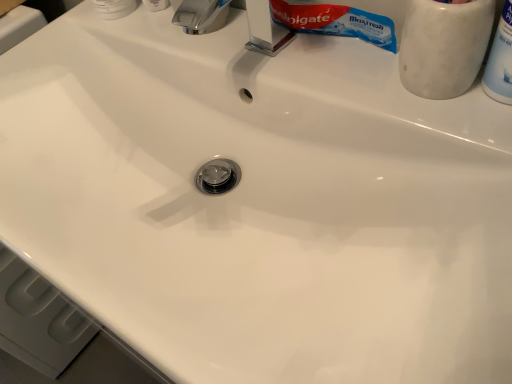
What is the approximate width of chrome metallic faucet at upper center?

It is 8.03 centimeters.

What do you see at coordinates (265, 30) in the screenshot? I see `chrome metallic faucet at upper center` at bounding box center [265, 30].

Locate an element on the screen. white marble toothbrush holder at upper right, which ranks as the second toiletry in right-to-left order is located at coordinates (444, 46).

Considering the points (117, 14) and (504, 31), which point is in front, point (117, 14) or point (504, 31)?

The point (504, 31) is more forward.

Is white plastic bottle at upper right, marked as the third toiletry in a left-to-right arrangement, located within white plastic toothpaste tube at upper left, which ranks as the first toiletry in left-to-right order?

No, white plastic bottle at upper right, marked as the third toiletry in a left-to-right arrangement, is located outside of white plastic toothpaste tube at upper left, which ranks as the first toiletry in left-to-right order.

From the image's perspective, between white plastic toothpaste tube at upper left, arranged as the 3th toiletry when viewed from the right, and white plastic bottle at upper right, which is counted as the first toiletry, starting from the right, who is located below?

white plastic bottle at upper right, which is counted as the first toiletry, starting from the right, is shown below in the image.

Is white plastic bottle at upper right, marked as the third toiletry in a left-to-right arrangement, positioned with its back to chrome metallic faucet at upper center?

No, white plastic bottle at upper right, marked as the third toiletry in a left-to-right arrangement,'s orientation is not away from chrome metallic faucet at upper center.

At what (x,y) coordinates should I click in order to perform the action: click on faucet on the left of white plastic bottle at upper right, marked as the third toiletry in a left-to-right arrangement. Please return your answer as a coordinate pair (x, y). This screenshot has width=512, height=384. Looking at the image, I should click on pyautogui.click(x=265, y=30).

From a real-world perspective, is white plastic bottle at upper right, which is counted as the first toiletry, starting from the right, above or below chrome metallic faucet at upper center?

In terms of real-world spatial position, white plastic bottle at upper right, which is counted as the first toiletry, starting from the right, is above chrome metallic faucet at upper center.

Considering the points (503, 61) and (196, 10), which point is behind, point (503, 61) or point (196, 10)?

The point (196, 10) is farther.

Is white marble toothbrush holder at upper right, acting as the second toiletry starting from the left, at the back of chrome metallic faucet at upper center?

No, chrome metallic faucet at upper center's orientation is not away from white marble toothbrush holder at upper right, acting as the second toiletry starting from the left.

Who is smaller, chrome metallic faucet at upper center or white marble toothbrush holder at upper right, which ranks as the second toiletry in right-to-left order?

Smaller between the two is chrome metallic faucet at upper center.

Is chrome metallic faucet at upper center in front of or behind white marble toothbrush holder at upper right, acting as the second toiletry starting from the left, in the image?

Clearly, chrome metallic faucet at upper center is behind white marble toothbrush holder at upper right, acting as the second toiletry starting from the left.

Is point (399, 63) behind point (124, 8)?

No, (399, 63) is closer to viewer.

Who is bigger, white marble toothbrush holder at upper right, acting as the second toiletry starting from the left, or white plastic toothpaste tube at upper left, arranged as the 3th toiletry when viewed from the right?

Bigger between the two is white marble toothbrush holder at upper right, acting as the second toiletry starting from the left.

From the image's perspective, relative to white plastic toothpaste tube at upper left, arranged as the 3th toiletry when viewed from the right, is white marble toothbrush holder at upper right, which ranks as the second toiletry in right-to-left order, above or below?

white marble toothbrush holder at upper right, which ranks as the second toiletry in right-to-left order, is situated lower than white plastic toothpaste tube at upper left, arranged as the 3th toiletry when viewed from the right, in the image.

From a real-world perspective, who is located lower, white plastic toothpaste tube at upper left, which ranks as the first toiletry in left-to-right order, or chrome metallic faucet at upper center?

In real-world perspective, white plastic toothpaste tube at upper left, which ranks as the first toiletry in left-to-right order, is lower.

Does white plastic toothpaste tube at upper left, which ranks as the first toiletry in left-to-right order, turn towards chrome metallic faucet at upper center?

No, white plastic toothpaste tube at upper left, which ranks as the first toiletry in left-to-right order, does not turn towards chrome metallic faucet at upper center.

You are a GUI agent. You are given a task and a screenshot of the screen. Output one action in this format:
    pyautogui.click(x=<x>, y=<y>)
    Task: Click on the faucet located above the white plastic toothpaste tube at upper left, which ranks as the first toiletry in left-to-right order (from a real-world perspective)
    The height and width of the screenshot is (384, 512).
    Given the screenshot: What is the action you would take?
    pyautogui.click(x=265, y=30)

Looking at the image, does white plastic toothpaste tube at upper left, arranged as the 3th toiletry when viewed from the right, seem bigger or smaller compared to chrome metallic faucet at upper center?

white plastic toothpaste tube at upper left, arranged as the 3th toiletry when viewed from the right, is smaller than chrome metallic faucet at upper center.

Who is shorter, white marble toothbrush holder at upper right, which ranks as the second toiletry in right-to-left order, or chrome metallic faucet at upper center?

chrome metallic faucet at upper center.

How different are the orientations of white marble toothbrush holder at upper right, acting as the second toiletry starting from the left, and chrome metallic faucet at upper center in degrees?

The angular difference between white marble toothbrush holder at upper right, acting as the second toiletry starting from the left, and chrome metallic faucet at upper center is 0.000556 degrees.

Is white marble toothbrush holder at upper right, which ranks as the second toiletry in right-to-left order, far from chrome metallic faucet at upper center?

white marble toothbrush holder at upper right, which ranks as the second toiletry in right-to-left order, is actually quite close to chrome metallic faucet at upper center.

Is white marble toothbrush holder at upper right, which ranks as the second toiletry in right-to-left order, looking in the opposite direction of chrome metallic faucet at upper center?

No, white marble toothbrush holder at upper right, which ranks as the second toiletry in right-to-left order, is not facing away from chrome metallic faucet at upper center.

From a real-world perspective, is white plastic bottle at upper right, marked as the third toiletry in a left-to-right arrangement, located higher than white plastic toothpaste tube at upper left, which ranks as the first toiletry in left-to-right order?

Yes, from a real-world perspective, white plastic bottle at upper right, marked as the third toiletry in a left-to-right arrangement, is over white plastic toothpaste tube at upper left, which ranks as the first toiletry in left-to-right order

Can you tell me how much white plastic bottle at upper right, marked as the third toiletry in a left-to-right arrangement, and white plastic toothpaste tube at upper left, arranged as the 3th toiletry when viewed from the right, differ in facing direction?

The angle between the facing direction of white plastic bottle at upper right, marked as the third toiletry in a left-to-right arrangement, and the facing direction of white plastic toothpaste tube at upper left, arranged as the 3th toiletry when viewed from the right, is 0.000768 degrees.

Which object is positioned more to the left, white plastic bottle at upper right, marked as the third toiletry in a left-to-right arrangement, or white plastic toothpaste tube at upper left, arranged as the 3th toiletry when viewed from the right?

white plastic toothpaste tube at upper left, arranged as the 3th toiletry when viewed from the right.

The height and width of the screenshot is (384, 512). I want to click on the 2nd toiletry to the left of the white plastic bottle at upper right, marked as the third toiletry in a left-to-right arrangement, starting your count from the anchor, so pos(115,8).

Identify the location of the 2nd toiletry behind the white plastic bottle at upper right, which is counted as the first toiletry, starting from the right, starting your count from the anchor. The image size is (512, 384). (115, 8).

Locate an element on the screen. Image resolution: width=512 pixels, height=384 pixels. the 2nd toiletry to the right of the chrome metallic faucet at upper center, starting your count from the anchor is located at coordinates (500, 60).

Estimate the real-world distances between objects in this image. Which object is closer to white marble toothbrush holder at upper right, which ranks as the second toiletry in right-to-left order, white plastic bottle at upper right, marked as the third toiletry in a left-to-right arrangement, or white plastic toothpaste tube at upper left, arranged as the 3th toiletry when viewed from the right?

white plastic bottle at upper right, marked as the third toiletry in a left-to-right arrangement, is closer to white marble toothbrush holder at upper right, which ranks as the second toiletry in right-to-left order.

Looking at the image, which one is located further to chrome metallic faucet at upper center, white plastic bottle at upper right, marked as the third toiletry in a left-to-right arrangement, or white plastic toothpaste tube at upper left, which ranks as the first toiletry in left-to-right order?

Based on the image, white plastic bottle at upper right, marked as the third toiletry in a left-to-right arrangement, appears to be further to chrome metallic faucet at upper center.

Looking at the image, which one is located closer to chrome metallic faucet at upper center, white marble toothbrush holder at upper right, which ranks as the second toiletry in right-to-left order, or white plastic bottle at upper right, marked as the third toiletry in a left-to-right arrangement?

white marble toothbrush holder at upper right, which ranks as the second toiletry in right-to-left order, is closer to chrome metallic faucet at upper center.

Estimate the real-world distances between objects in this image. Which object is closer to white marble toothbrush holder at upper right, which ranks as the second toiletry in right-to-left order, white plastic toothpaste tube at upper left, arranged as the 3th toiletry when viewed from the right, or chrome metallic faucet at upper center?

chrome metallic faucet at upper center.

Looking at the image, which one is located further to white marble toothbrush holder at upper right, which ranks as the second toiletry in right-to-left order, chrome metallic faucet at upper center or white plastic toothpaste tube at upper left, arranged as the 3th toiletry when viewed from the right?

Based on the image, white plastic toothpaste tube at upper left, arranged as the 3th toiletry when viewed from the right, appears to be further to white marble toothbrush holder at upper right, which ranks as the second toiletry in right-to-left order.

From the image, which object appears to be farther from white plastic bottle at upper right, which is counted as the first toiletry, starting from the right, white marble toothbrush holder at upper right, which ranks as the second toiletry in right-to-left order, or chrome metallic faucet at upper center?

Based on the image, chrome metallic faucet at upper center appears to be further to white plastic bottle at upper right, which is counted as the first toiletry, starting from the right.

From the image, which object appears to be nearer to white marble toothbrush holder at upper right, which ranks as the second toiletry in right-to-left order, chrome metallic faucet at upper center or white plastic bottle at upper right, which is counted as the first toiletry, starting from the right?

Among the two, white plastic bottle at upper right, which is counted as the first toiletry, starting from the right, is located nearer to white marble toothbrush holder at upper right, which ranks as the second toiletry in right-to-left order.

When comparing their distances from white plastic toothpaste tube at upper left, arranged as the 3th toiletry when viewed from the right, does white plastic bottle at upper right, marked as the third toiletry in a left-to-right arrangement, or chrome metallic faucet at upper center seem closer?

Among the two, chrome metallic faucet at upper center is located nearer to white plastic toothpaste tube at upper left, arranged as the 3th toiletry when viewed from the right.

Where is `faucet between white plastic toothpaste tube at upper left, which ranks as the first toiletry in left-to-right order, and white plastic bottle at upper right, marked as the third toiletry in a left-to-right arrangement, in the horizontal direction`? faucet between white plastic toothpaste tube at upper left, which ranks as the first toiletry in left-to-right order, and white plastic bottle at upper right, marked as the third toiletry in a left-to-right arrangement, in the horizontal direction is located at coordinates (265, 30).

Image resolution: width=512 pixels, height=384 pixels. Identify the location of toiletry between white plastic toothpaste tube at upper left, which ranks as the first toiletry in left-to-right order, and white plastic bottle at upper right, which is counted as the first toiletry, starting from the right, from left to right. (444, 46).

The image size is (512, 384). I want to click on toiletry located between chrome metallic faucet at upper center and white plastic bottle at upper right, which is counted as the first toiletry, starting from the right, in the left-right direction, so click(444, 46).

This screenshot has width=512, height=384. Identify the location of faucet between white plastic toothpaste tube at upper left, which ranks as the first toiletry in left-to-right order, and white marble toothbrush holder at upper right, acting as the second toiletry starting from the left, from left to right. (265, 30).